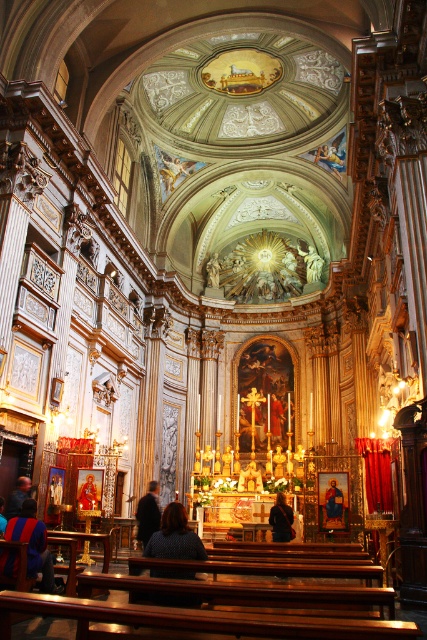
You are a visitor standing at the entrance of the church and notice two items at the center of the room. The items are the dark blue textured sweater at center and the dark brown leather coat at center. Which item is wider?

The dark blue textured sweater at center is wider than the dark brown leather coat at center.

You are standing in the grand church and want to take a photo of the dark brown leather jacket at center. Your camera is on a tripod 213.07 feet away. Is the camera far enough to capture the entire jacket in the frame?

The dark brown leather jacket at center and camera are 213.07 feet apart from each other. To determine if the camera is far enough, you would need to consider the lens focal length and sensor size. However, based on the provided information alone, the distance is quite substantial, so it might be challenging to capture the entire jacket unless using a wide angle lens.